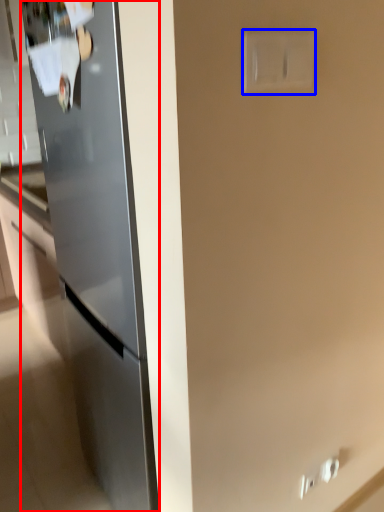
Question: Which of the following is the closest to the observer, refrigerator (highlighted by a red box) or electric outlet (highlighted by a blue box)?

Choices:
 (A) refrigerator
 (B) electric outlet

Answer: (B)